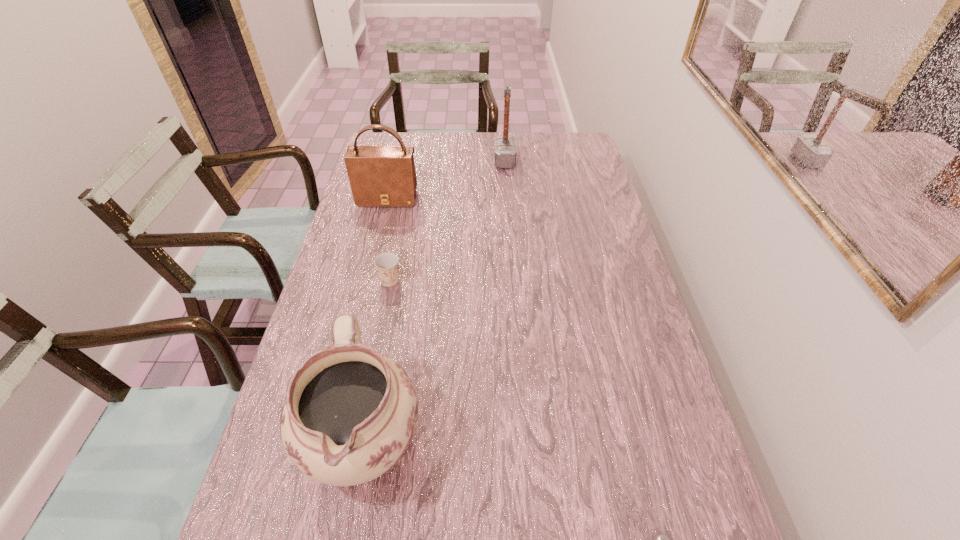
Where is `unoccupied area between the shoulder bag and the second nearest object`? This screenshot has width=960, height=540. unoccupied area between the shoulder bag and the second nearest object is located at coordinates (376, 317).

What are the coordinates of `vacant point located between the shoulder bag and the second nearest object` in the screenshot? It's located at point(376,317).

In order to click on free space that is in between the fourth nearest object and the farthest object in this screenshot , I will do `click(446, 180)`.

The image size is (960, 540). In order to click on vacant space in between the fourth nearest object and the third farthest object in this screenshot , I will do `click(389, 240)`.

Select which object is the closest to the shortest object. Please provide its 2D coordinates. Your answer should be formatted as a tuple, i.e. [(x, y)], where the tuple contains the x and y coordinates of a point satisfying the conditions above.

[(350, 413)]

Locate an element on the screen. Image resolution: width=960 pixels, height=540 pixels. object that can be found as the third closest to the shoulder bag is located at coordinates (350, 413).

The width and height of the screenshot is (960, 540). What are the coordinates of `free space that satisfies the following two spatial constraints: 1. on the striking surface of the taller hammer; 2. on the front flap of the fourth nearest object` in the screenshot? It's located at (507, 199).

You are a GUI agent. You are given a task and a screenshot of the screen. Output one action in this format:
    pyautogui.click(x=<x>, y=<y>)
    Task: Click on the vacant position in the image that satisfies the following two spatial constraints: 1. on the striking surface of the taller hammer; 2. on the front side of the Dixie cup
    
    Given the screenshot: What is the action you would take?
    pyautogui.click(x=514, y=280)

The image size is (960, 540). What are the coordinates of `vacant space that satisfies the following two spatial constraints: 1. on the front flap of the second farthest object; 2. on the right side of the third nearest object` in the screenshot? It's located at (368, 280).

What are the coordinates of `vacant region that satisfies the following two spatial constraints: 1. on the front flap of the fourth tallest object; 2. on the left side of the fourth nearest object` in the screenshot? It's located at (368, 280).